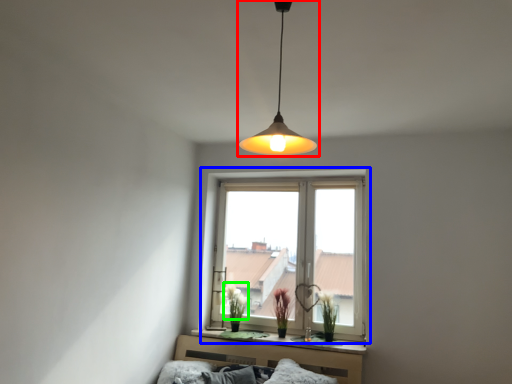
Question: Estimate the real-world distances between objects in this image. Which object is closer to lamp (highlighted by a red box), window (highlighted by a blue box) or flower (highlighted by a green box)?

Choices:
 (A) window
 (B) flower

Answer: (A)